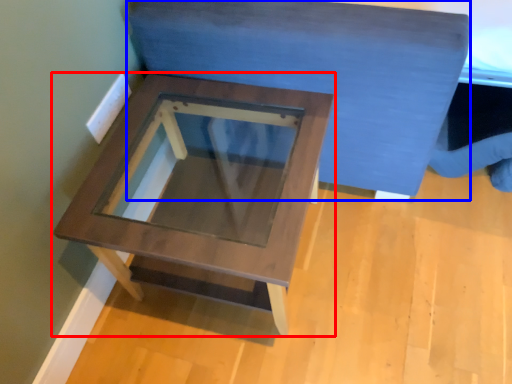
Question: Among these objects, which one is farthest to the camera, table (highlighted by a red box) or bedding (highlighted by a blue box)?

Choices:
 (A) table
 (B) bedding

Answer: (A)